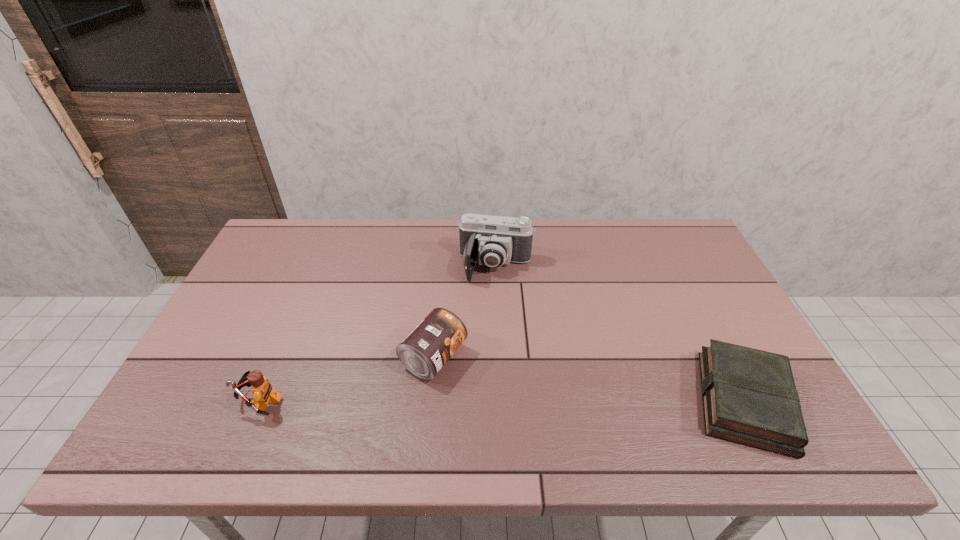
At what (x,y) coordinates should I click in order to perform the action: click on free space that is in between the can and the leftmost object. Please return your answer as a coordinate pair (x, y). The image size is (960, 540). Looking at the image, I should click on (348, 379).

Identify the location of empty space between the farthest object and the shortest object. The width and height of the screenshot is (960, 540). (620, 334).

At what (x,y) coordinates should I click in order to perform the action: click on vacant space that's between the Lego and the farthest object. Please return your answer as a coordinate pair (x, y). Looking at the image, I should click on (378, 334).

You are a GUI agent. You are given a task and a screenshot of the screen. Output one action in this format:
    pyautogui.click(x=<x>, y=<y>)
    Task: Click on the vacant region between the Lego and the camera
    Image resolution: width=960 pixels, height=540 pixels.
    Given the screenshot: What is the action you would take?
    pyautogui.click(x=378, y=334)

The image size is (960, 540). Find the location of `empty location between the book and the can`. empty location between the book and the can is located at coordinates (589, 379).

I want to click on free space between the can and the leftmost object, so click(x=348, y=379).

This screenshot has height=540, width=960. In order to click on vacant area that lies between the leftmost object and the tallest object in this screenshot , I will do `click(378, 334)`.

At what (x,y) coordinates should I click in order to perform the action: click on vacant area that lies between the shortest object and the can. Please return your answer as a coordinate pair (x, y). Image resolution: width=960 pixels, height=540 pixels. Looking at the image, I should click on (589, 379).

Locate an element on the screen. This screenshot has width=960, height=540. object identified as the closest to the can is located at coordinates (492, 241).

Select which object appears as the second closest to the can. Please provide its 2D coordinates. Your answer should be formatted as a tuple, i.e. [(x, y)], where the tuple contains the x and y coordinates of a point satisfying the conditions above.

[(262, 390)]